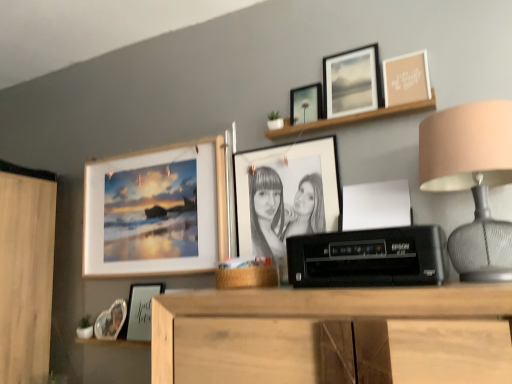
Describe the element at coordinates (352, 82) in the screenshot. This screenshot has height=384, width=512. I see `matte black picture frame at upper center, the 2th picture frame in the right-to-left sequence` at that location.

What is the approximate height of black plastic printer at center?

black plastic printer at center is 5.80 inches in height.

Find the location of a particular element. This screenshot has height=384, width=512. matte wooden picture frame at upper left, the sixth picture frame viewed from the right is located at coordinates (156, 211).

Consider the image. What is the approximate width of matte wooden picture frame at upper left, marked as the 2th picture frame in a left-to-right arrangement?

It is 7.51 centimeters.

This screenshot has width=512, height=384. Describe the element at coordinates (111, 342) in the screenshot. I see `white matte frame at lower center, which ranks as the 1th shelf in back-to-front order` at that location.

Where is `matte black picture frame at lower left, which is counted as the 5th picture frame, starting from the right`? This screenshot has width=512, height=384. matte black picture frame at lower left, which is counted as the 5th picture frame, starting from the right is located at coordinates (141, 310).

Image resolution: width=512 pixels, height=384 pixels. Identify the location of matte black photo frame at center, which is counted as the fourth picture frame, starting from the right. (285, 196).

Identify the location of clear glass photo frame at lower left, marked as the 7th picture frame in a right-to-left arrangement. (111, 321).

In order to face clear glass photo frame at lower left, marked as the 7th picture frame in a right-to-left arrangement, should I rotate leftwards or rightwards?

To align with it, rotate left about 19.364°.

At what (x,y) coordinates should I click in order to perform the action: click on matte black picture frame at upper center, which is counted as the sixth picture frame, starting from the left. Please return your answer as a coordinate pair (x, y). Looking at the image, I should click on (352, 82).

Who is taller, matte black picture frame at upper center, which appears as the third picture frame when viewed from the right, or matte black photo frame at center, positioned as the fourth picture frame in left-to-right order?

matte black photo frame at center, positioned as the fourth picture frame in left-to-right order.

From the image's perspective, is matte black picture frame at upper center, the fifth picture frame in the left-to-right sequence, below matte black photo frame at center, which is counted as the fourth picture frame, starting from the right?

No, from the image's perspective, matte black picture frame at upper center, the fifth picture frame in the left-to-right sequence, is not beneath matte black photo frame at center, which is counted as the fourth picture frame, starting from the right.

Is matte black picture frame at upper center, the fifth picture frame in the left-to-right sequence, to the left of matte black photo frame at center, positioned as the fourth picture frame in left-to-right order, from the viewer's perspective?

No.

Which object is closer to the camera taking this photo, black plastic printer at center or matte black photo frame at center, which is counted as the fourth picture frame, starting from the right?

Positioned in front is black plastic printer at center.

Considering the sizes of objects black plastic printer at center and matte black photo frame at center, positioned as the fourth picture frame in left-to-right order, in the image provided, who is shorter, black plastic printer at center or matte black photo frame at center, positioned as the fourth picture frame in left-to-right order,?

Standing shorter between the two is black plastic printer at center.

Is black plastic printer at center completely or partially outside of matte black photo frame at center, positioned as the fourth picture frame in left-to-right order?

That's correct, black plastic printer at center is outside of matte black photo frame at center, positioned as the fourth picture frame in left-to-right order.

Which point is more forward, (362, 269) or (236, 195)?

The point (362, 269) is closer.

Which of these two, matte black picture frame at lower left, which is counted as the 5th picture frame, starting from the right, or black plastic printer at center, is smaller?

matte black picture frame at lower left, which is counted as the 5th picture frame, starting from the right.

Considering the sizes of objects matte black picture frame at lower left, which is counted as the 5th picture frame, starting from the right, and black plastic printer at center in the image provided, who is shorter, matte black picture frame at lower left, which is counted as the 5th picture frame, starting from the right, or black plastic printer at center?

With less height is black plastic printer at center.

Is clear glass photo frame at lower left, marked as the 7th picture frame in a right-to-left arrangement, spatially inside matte black picture frame at lower left, the 3th picture frame in the left-to-right sequence, or outside of it?

clear glass photo frame at lower left, marked as the 7th picture frame in a right-to-left arrangement, is located beyond the bounds of matte black picture frame at lower left, the 3th picture frame in the left-to-right sequence.

Could you measure the distance between clear glass photo frame at lower left, the first picture frame in the left-to-right sequence, and matte black picture frame at lower left, which is counted as the 5th picture frame, starting from the right?

They are 3.47 inches apart.

Are clear glass photo frame at lower left, marked as the 7th picture frame in a right-to-left arrangement, and matte black picture frame at lower left, the 3th picture frame in the left-to-right sequence, making contact?

Yes, clear glass photo frame at lower left, marked as the 7th picture frame in a right-to-left arrangement, is in contact with matte black picture frame at lower left, the 3th picture frame in the left-to-right sequence.

Considering the relative sizes of clear glass photo frame at lower left, the first picture frame in the left-to-right sequence, and matte black picture frame at lower left, the 3th picture frame in the left-to-right sequence, in the image provided, is clear glass photo frame at lower left, the first picture frame in the left-to-right sequence, thinner than matte black picture frame at lower left, the 3th picture frame in the left-to-right sequence,?

Yes, clear glass photo frame at lower left, the first picture frame in the left-to-right sequence, is thinner than matte black picture frame at lower left, the 3th picture frame in the left-to-right sequence.

This screenshot has height=384, width=512. Identify the location of the 1st picture frame in front of the matte black picture frame at upper center, the fifth picture frame in the left-to-right sequence. click(x=352, y=82).

Is matte black picture frame at upper center, the fifth picture frame in the left-to-right sequence, aimed at matte black picture frame at upper center, which is counted as the sixth picture frame, starting from the left?

No, matte black picture frame at upper center, the fifth picture frame in the left-to-right sequence, is not facing towards matte black picture frame at upper center, which is counted as the sixth picture frame, starting from the left.

Considering the sizes of objects matte black picture frame at upper center, which appears as the third picture frame when viewed from the right, and matte black picture frame at upper center, the 2th picture frame in the right-to-left sequence, in the image provided, who is thinner, matte black picture frame at upper center, which appears as the third picture frame when viewed from the right, or matte black picture frame at upper center, the 2th picture frame in the right-to-left sequence,?

matte black picture frame at upper center, the 2th picture frame in the right-to-left sequence.

From the picture: Can you confirm if matte black picture frame at upper center, which appears as the third picture frame when viewed from the right, is positioned to the right of matte black picture frame at upper center, which is counted as the sixth picture frame, starting from the left?

In fact, matte black picture frame at upper center, which appears as the third picture frame when viewed from the right, is to the left of matte black picture frame at upper center, which is counted as the sixth picture frame, starting from the left.

Between point (145, 321) and point (298, 161), which one is positioned in front?

Point (298, 161)

From the image's perspective, is matte black picture frame at lower left, the 3th picture frame in the left-to-right sequence, over matte black photo frame at center, positioned as the fourth picture frame in left-to-right order?

Incorrect, from the image's perspective, matte black picture frame at lower left, the 3th picture frame in the left-to-right sequence, is lower than matte black photo frame at center, positioned as the fourth picture frame in left-to-right order.

Is matte black picture frame at lower left, which is counted as the 5th picture frame, starting from the right, outside of matte black photo frame at center, positioned as the fourth picture frame in left-to-right order?

Indeed, matte black picture frame at lower left, which is counted as the 5th picture frame, starting from the right, is completely outside matte black photo frame at center, positioned as the fourth picture frame in left-to-right order.

Which is more to the left, matte black picture frame at lower left, which is counted as the 5th picture frame, starting from the right, or matte black photo frame at center, which is counted as the fourth picture frame, starting from the right?

Positioned to the left is matte black picture frame at lower left, which is counted as the 5th picture frame, starting from the right.

Could you tell me if wooden frame at upper center, the 1th shelf positioned from the right, is turned towards matte wooden picture frame at upper left, the sixth picture frame viewed from the right?

No, wooden frame at upper center, the 1th shelf positioned from the right, is not turned towards matte wooden picture frame at upper left, the sixth picture frame viewed from the right.

Which object is positioned more to the left, wooden frame at upper center, the 1th shelf positioned from the right, or matte wooden picture frame at upper left, marked as the 2th picture frame in a left-to-right arrangement?

Positioned to the left is matte wooden picture frame at upper left, marked as the 2th picture frame in a left-to-right arrangement.

Is wooden frame at upper center, the first shelf when ordered from front to back, placed right next to matte wooden picture frame at upper left, marked as the 2th picture frame in a left-to-right arrangement?

wooden frame at upper center, the first shelf when ordered from front to back, is not next to matte wooden picture frame at upper left, marked as the 2th picture frame in a left-to-right arrangement, and they're not touching.

Looking at this image, can we say wooden frame at upper center, arranged as the second shelf when viewed from the left, lies outside matte wooden picture frame at upper left, the sixth picture frame viewed from the right?

Answer: Absolutely, wooden frame at upper center, arranged as the second shelf when viewed from the left, is external to matte wooden picture frame at upper left, the sixth picture frame viewed from the right.

From a real-world perspective, starting from the matte black photo frame at center, positioned as the fourth picture frame in left-to-right order, which picture frame is the 2nd one vertically above it? Please provide its 2D coordinates.

[(306, 104)]

Find the location of a particular element. the 2nd picture frame counting from the left side of the black plastic printer at center is located at coordinates (285, 196).

From the image, which object appears to be nearer to matte wooden picture frame at upper left, the sixth picture frame viewed from the right, beige fabric lampshade at right or wooden frame at upper center, positioned as the 2th shelf in back-to-front order?

Based on the image, wooden frame at upper center, positioned as the 2th shelf in back-to-front order, appears to be nearer to matte wooden picture frame at upper left, the sixth picture frame viewed from the right.

In the scene shown: Based on their spatial positions, is wooden picture frame at upper right, which ranks as the first picture frame in right-to-left order, or clear glass photo frame at lower left, marked as the 7th picture frame in a right-to-left arrangement, closer to black plastic printer at center?

Among the two, wooden picture frame at upper right, which ranks as the first picture frame in right-to-left order, is located nearer to black plastic printer at center.

When comparing their distances from matte black picture frame at upper center, which appears as the third picture frame when viewed from the right, does white matte frame at lower center, marked as the second shelf in a front-to-back arrangement, or matte wooden picture frame at upper left, marked as the 2th picture frame in a left-to-right arrangement, seem closer?

matte wooden picture frame at upper left, marked as the 2th picture frame in a left-to-right arrangement, lies closer to matte black picture frame at upper center, which appears as the third picture frame when viewed from the right, than the other object.

When comparing their distances from black plastic printer at center, does matte black picture frame at upper center, the fifth picture frame in the left-to-right sequence, or clear glass photo frame at lower left, marked as the 7th picture frame in a right-to-left arrangement, seem further?

clear glass photo frame at lower left, marked as the 7th picture frame in a right-to-left arrangement, is further to black plastic printer at center.

When comparing their distances from matte black picture frame at lower left, the 3th picture frame in the left-to-right sequence, does matte black picture frame at upper center, which is counted as the sixth picture frame, starting from the left, or clear glass photo frame at lower left, marked as the 7th picture frame in a right-to-left arrangement, seem closer?

clear glass photo frame at lower left, marked as the 7th picture frame in a right-to-left arrangement.

Based on their spatial positions, is wooden picture frame at upper right, which ranks as the first picture frame in right-to-left order, or matte black picture frame at lower left, which is counted as the 5th picture frame, starting from the right, further from matte black photo frame at center, positioned as the fourth picture frame in left-to-right order?

matte black picture frame at lower left, which is counted as the 5th picture frame, starting from the right, is further to matte black photo frame at center, positioned as the fourth picture frame in left-to-right order.

Looking at the image, which one is located closer to wooden frame at upper center, placed as the second shelf when sorted from bottom to top, white matte frame at lower center, which is the first shelf from left to right, or beige fabric lampshade at right?

beige fabric lampshade at right.

Which object lies nearer to the anchor point beige fabric lampshade at right, black plastic printer at center or matte black picture frame at upper center, the 2th picture frame in the right-to-left sequence?

black plastic printer at center is positioned closer to the anchor beige fabric lampshade at right.

This screenshot has height=384, width=512. In order to click on shelf between clear glass photo frame at lower left, marked as the 7th picture frame in a right-to-left arrangement, and matte black picture frame at lower left, the 3th picture frame in the left-to-right sequence in this screenshot , I will do `click(111, 342)`.

Locate an element on the screen. Image resolution: width=512 pixels, height=384 pixels. picture frame between beige fabric lampshade at right and matte black photo frame at center, which is counted as the fourth picture frame, starting from the right, from front to back is located at coordinates (406, 79).

Where is `shelf between wooden picture frame at upper right, which ranks as the first picture frame in right-to-left order, and matte black photo frame at center, positioned as the fourth picture frame in left-to-right order, from top to bottom`? shelf between wooden picture frame at upper right, which ranks as the first picture frame in right-to-left order, and matte black photo frame at center, positioned as the fourth picture frame in left-to-right order, from top to bottom is located at coordinates (352, 118).

In order to click on table lamp between matte black picture frame at upper center, the 2th picture frame in the right-to-left sequence, and black plastic printer at center in the up-down direction in this screenshot , I will do `click(472, 181)`.